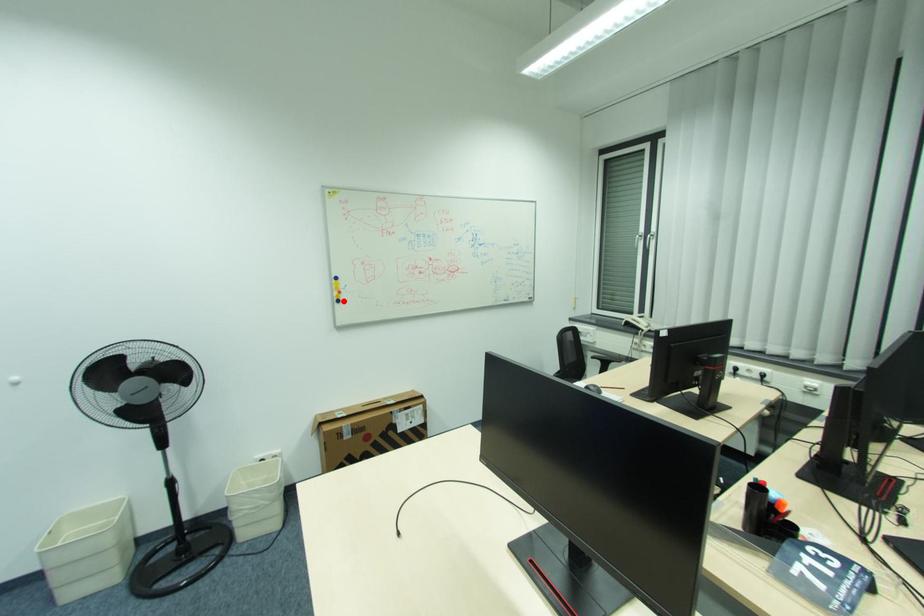
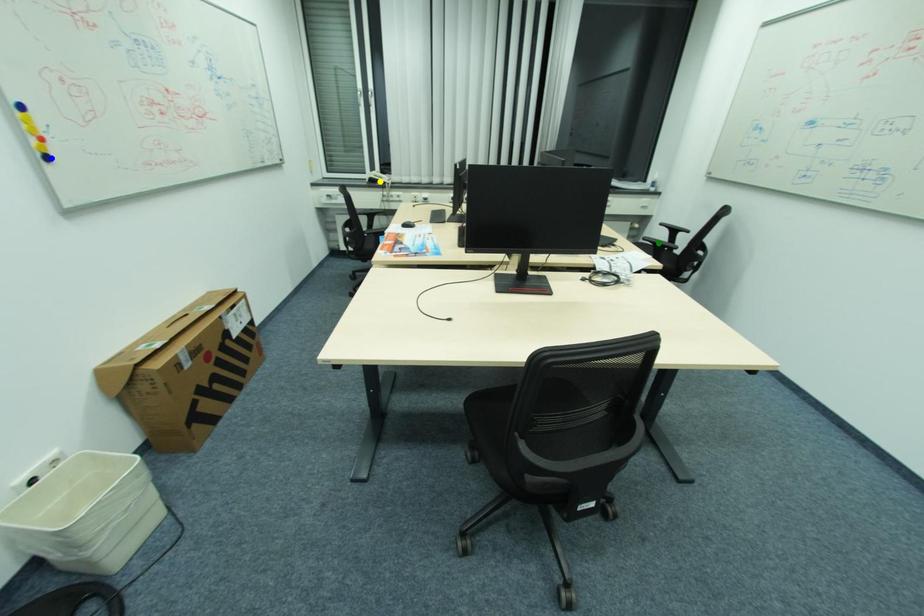
Question: I am providing you with two images of the same scene from different viewpoints. A red point is marked on the first image. You are given multiple points on the second image. Which mark in image 2 goes with the point in image 1?

Choices:
 (A) yellow point
 (B) blue point
 (C) green point

Answer: (B)